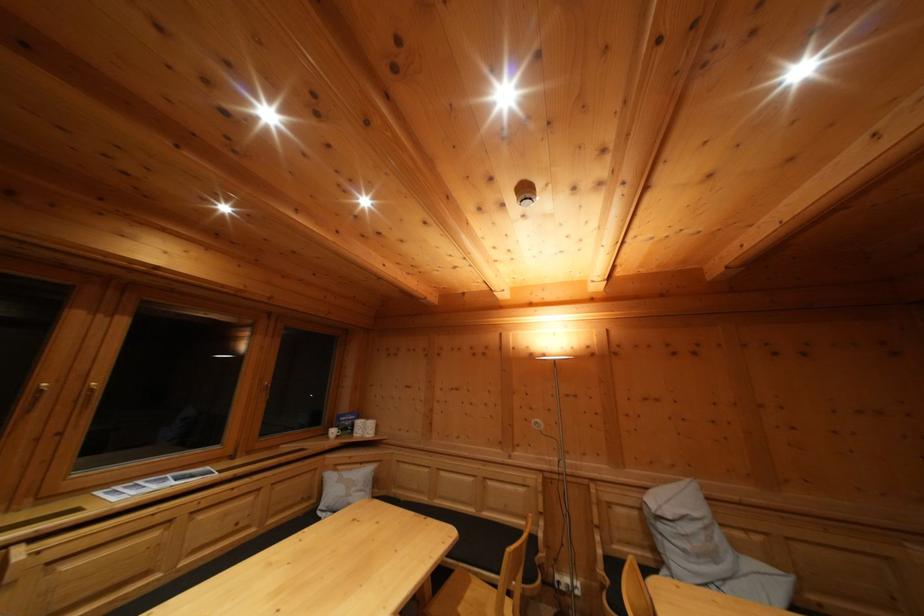
The width and height of the screenshot is (924, 616). I want to click on chair sitting surface, so click(470, 597).